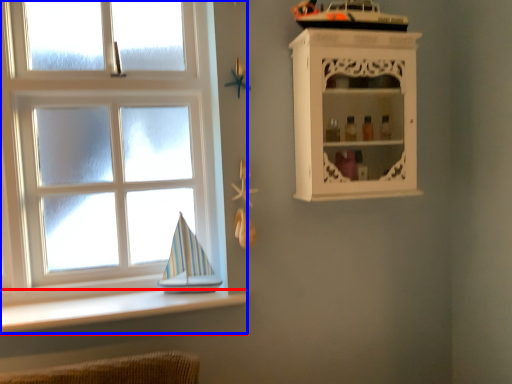
Question: Which of the following is the closest to the observer, ledge (highlighted by a red box) or window (highlighted by a blue box)?

Choices:
 (A) ledge
 (B) window

Answer: (A)